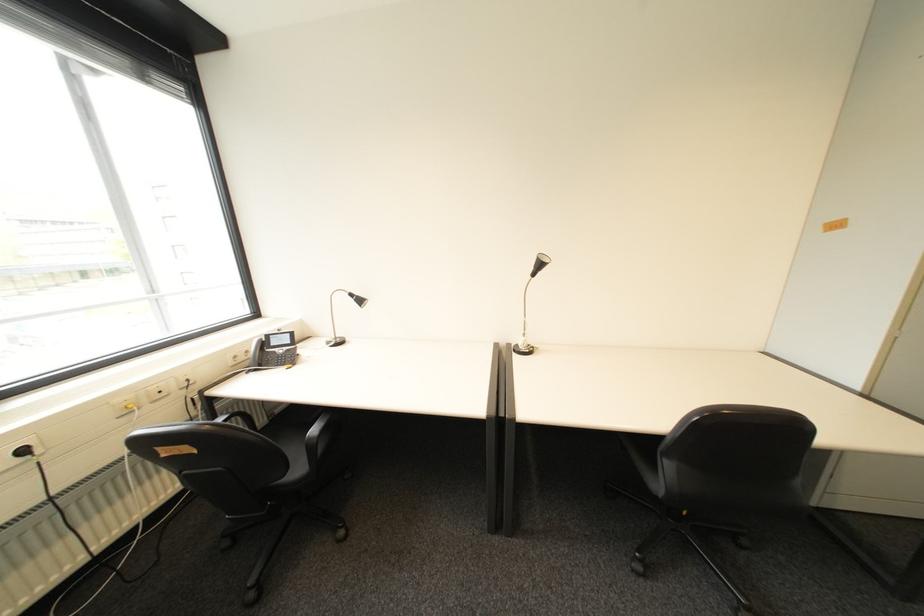
Image resolution: width=924 pixels, height=616 pixels. What do you see at coordinates (319, 440) in the screenshot?
I see `the black chair armrest` at bounding box center [319, 440].